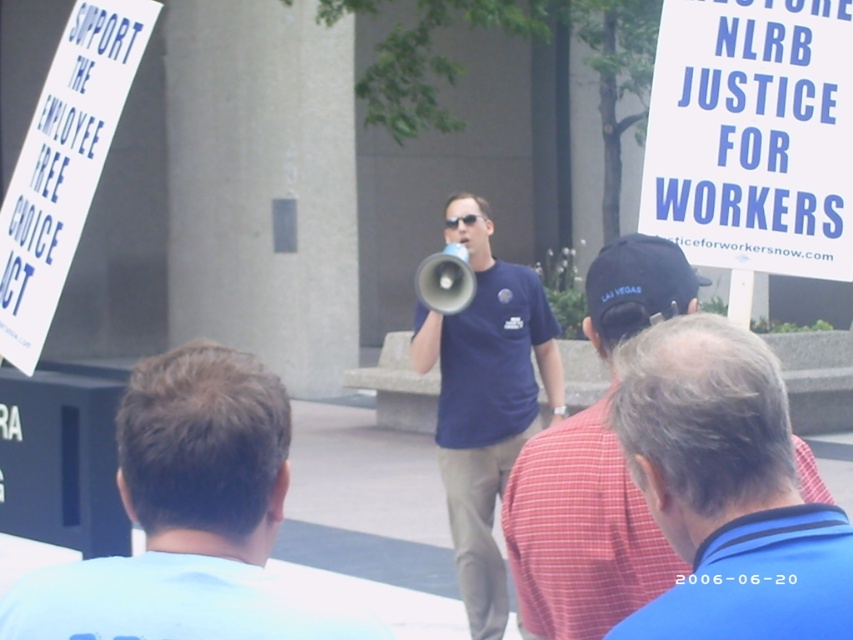
Question: Is red plaid shirt at center to the right of blue cotton shirt at center from the viewer's perspective?

Choices:
 (A) no
 (B) yes

Answer: (B)

Question: Is red plaid shirt at center closer to the viewer compared to blue cotton shirt at center?

Choices:
 (A) yes
 (B) no

Answer: (A)

Question: Which object is the farthest from the blue cotton shirt at center?

Choices:
 (A) light blue t-shirt at lower left
 (B) red plaid shirt at center

Answer: (A)

Question: Among these points, which one is nearest to the camera?

Choices:
 (A) (509, 550)
 (B) (167, 480)

Answer: (B)

Question: From the image, what is the correct spatial relationship of red plaid shirt at center in relation to blue cotton shirt at center?

Choices:
 (A) left
 (B) right

Answer: (B)

Question: Which object is positioned farthest from the light blue t-shirt at lower left?

Choices:
 (A) blue cotton shirt at center
 (B) red plaid shirt at center

Answer: (A)